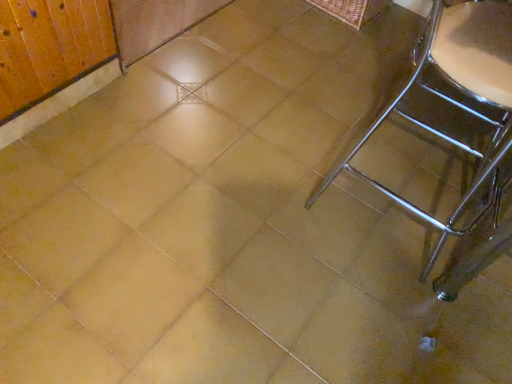
Find the location of a particular element. This screenshot has width=512, height=384. vacant area located to the right-hand side of polished chrome chair at right is located at coordinates (479, 230).